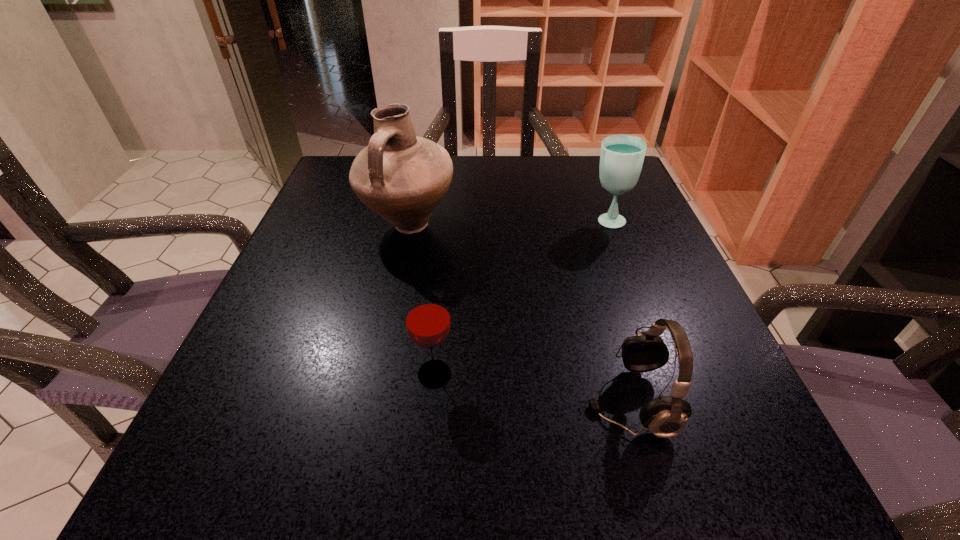
Where is `the tallest object`? Image resolution: width=960 pixels, height=540 pixels. the tallest object is located at coordinates (402, 177).

Locate an element on the screen. The image size is (960, 540). the right glass is located at coordinates (622, 155).

Find the location of a particular element. the shorter glass is located at coordinates (427, 317).

Where is `the left glass`? This screenshot has width=960, height=540. the left glass is located at coordinates (427, 317).

Locate an element on the screen. The width and height of the screenshot is (960, 540). headset is located at coordinates (666, 416).

Find the location of a particular element. vacant space located on the handle side of the pitcher is located at coordinates (379, 366).

Where is `free point located on the front of the right glass`? free point located on the front of the right glass is located at coordinates (649, 333).

This screenshot has height=540, width=960. Find the location of `vacant position located on the left of the nearer glass`. vacant position located on the left of the nearer glass is located at coordinates (250, 374).

This screenshot has width=960, height=540. Identify the location of vacant space positioned with the microphone on the side of the headset. (362, 401).

Find the location of `vacant space located 0.340m with the microphone on the side of the headset`. vacant space located 0.340m with the microphone on the side of the headset is located at coordinates (340, 401).